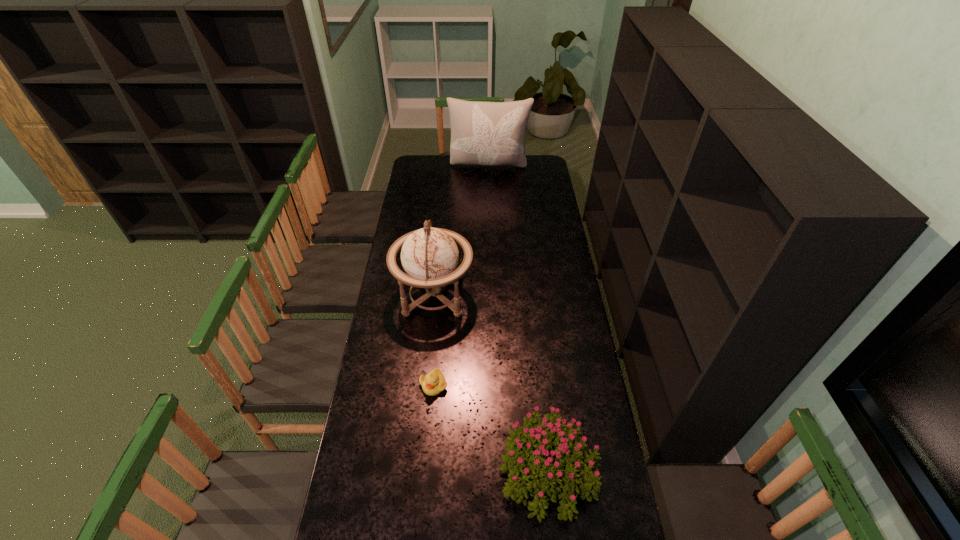
Locate an element on the screen. This screenshot has width=960, height=540. vacant area between the third farthest object and the globe is located at coordinates (434, 340).

Locate an element on the screen. The height and width of the screenshot is (540, 960). vacant region between the globe and the nearest object is located at coordinates (492, 384).

Find the location of a particular element. vacant space in between the third nearest object and the bouquet is located at coordinates (492, 384).

Locate an element on the screen. This screenshot has height=540, width=960. vacant space in between the third farthest object and the bouquet is located at coordinates (491, 428).

Locate an element on the screen. The image size is (960, 540). vacant space that's between the globe and the nearest object is located at coordinates (492, 384).

The width and height of the screenshot is (960, 540). I want to click on vacant space in between the third tallest object and the farthest object, so click(518, 319).

Locate which object is the third closest to the duckling. Please provide its 2D coordinates. Your answer should be formatted as a tuple, i.e. [(x, y)], where the tuple contains the x and y coordinates of a point satisfying the conditions above.

[(482, 133)]

Where is `object that stands as the third closest to the nearest object`? This screenshot has height=540, width=960. object that stands as the third closest to the nearest object is located at coordinates (482, 133).

Identify the location of vacant space that satisfies the following two spatial constraints: 1. at the face of the duckling; 2. on the left side of the third tallest object. The image size is (960, 540). (426, 471).

At what (x,y) coordinates should I click in order to perform the action: click on vacant area that satisfies the following two spatial constraints: 1. on the front side of the nearest object; 2. on the left side of the cushion. Please return your answer as a coordinate pair (x, y). Image resolution: width=960 pixels, height=540 pixels. Looking at the image, I should click on (497, 471).